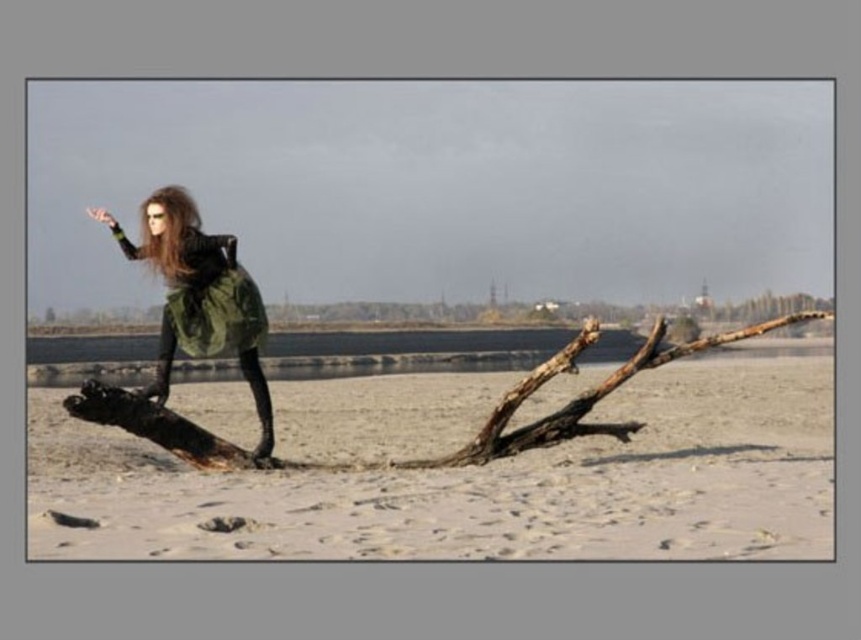
Is white sandy beach at center to the right of shiny brown hair at upper left from the viewer's perspective?

Correct, you'll find white sandy beach at center to the right of shiny brown hair at upper left.

Does white sandy beach at center appear under shiny brown hair at upper left?

Yes.

Is point (121, 497) farther from viewer compared to point (160, 218)?

That is False.

The width and height of the screenshot is (861, 640). Find the location of `white sandy beach at center`. white sandy beach at center is located at coordinates (485, 484).

Between white sandy beach at center and green matte dress at center, which one appears on the right side from the viewer's perspective?

Positioned to the right is white sandy beach at center.

Who is more distant from viewer, (146, 449) or (259, 429)?

The point (259, 429) is behind.

Is point (604, 531) less distant than point (234, 316)?

Yes.

The image size is (861, 640). Find the location of `white sandy beach at center`. white sandy beach at center is located at coordinates (485, 484).

Which is above, green matte dress at left or shiny brown hair at upper left?

shiny brown hair at upper left

Does point (193, 300) lie in front of point (177, 240)?

No, (193, 300) is further to viewer.

Where is `green matte dress at left`? The image size is (861, 640). green matte dress at left is located at coordinates (211, 301).